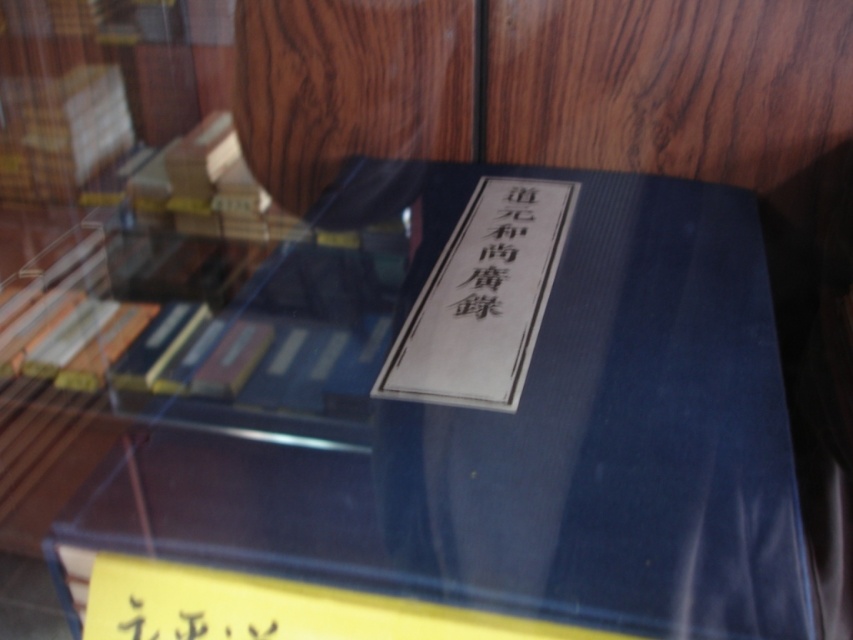
Which is in front, point (498, 227) or point (146, 625)?

Point (146, 625) is more forward.

Is black paper at center smaller than black paper at lower center?

No.

Where is `black paper at center`? The image size is (853, 640). black paper at center is located at coordinates (498, 257).

Is point (509, 355) farther from camera compared to point (456, 304)?

No, (509, 355) is closer to viewer.

Based on the photo, can you confirm if white paper book at center is shorter than black paper at center?

In fact, white paper book at center may be taller than black paper at center.

In order to click on white paper book at center in this screenshot , I will do `click(482, 298)`.

Is point (477, 198) behind point (155, 596)?

Yes, it is.

Does white paper book at center have a smaller size compared to black paper at lower center?

Actually, white paper book at center might be larger than black paper at lower center.

The image size is (853, 640). What do you see at coordinates (482, 298) in the screenshot?
I see `white paper book at center` at bounding box center [482, 298].

I want to click on white paper book at center, so click(x=482, y=298).